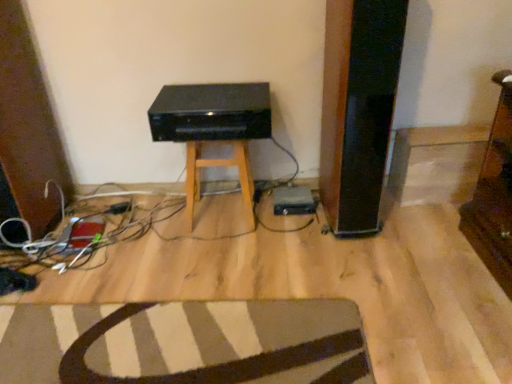
You are a GUI agent. You are given a task and a screenshot of the screen. Output one action in this format:
    pyautogui.click(x=<x>, y=<y>)
    Task: Click on the free location to the right of striped fabric rug at lower center
    
    Given the screenshot: What is the action you would take?
    pyautogui.click(x=372, y=284)